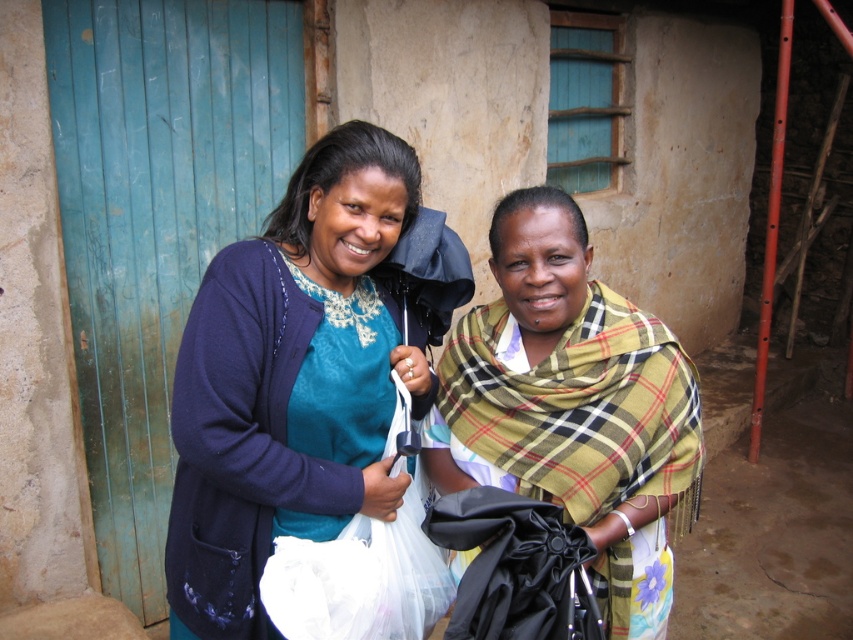
Question: Which object is closer to the camera taking this photo?

Choices:
 (A) plaid fabric shawl at center
 (B) matte blue sweater at center
 (C) white plastic bag at center

Answer: (A)

Question: Observing the image, what is the correct spatial positioning of matte blue sweater at center in reference to white plastic bag at center?

Choices:
 (A) above
 (B) below

Answer: (A)

Question: From the image, what is the correct spatial relationship of matte blue sweater at center in relation to white plastic bag at center?

Choices:
 (A) above
 (B) below

Answer: (A)

Question: Considering the real-world distances, which object is farthest from the matte blue sweater at center?

Choices:
 (A) white plastic bag at center
 (B) plaid fabric shawl at center

Answer: (B)

Question: Can you confirm if matte blue sweater at center is smaller than white plastic bag at center?

Choices:
 (A) yes
 (B) no

Answer: (B)

Question: Estimate the real-world distances between objects in this image. Which object is farther from the white plastic bag at center?

Choices:
 (A) matte blue sweater at center
 (B) plaid fabric shawl at center

Answer: (B)